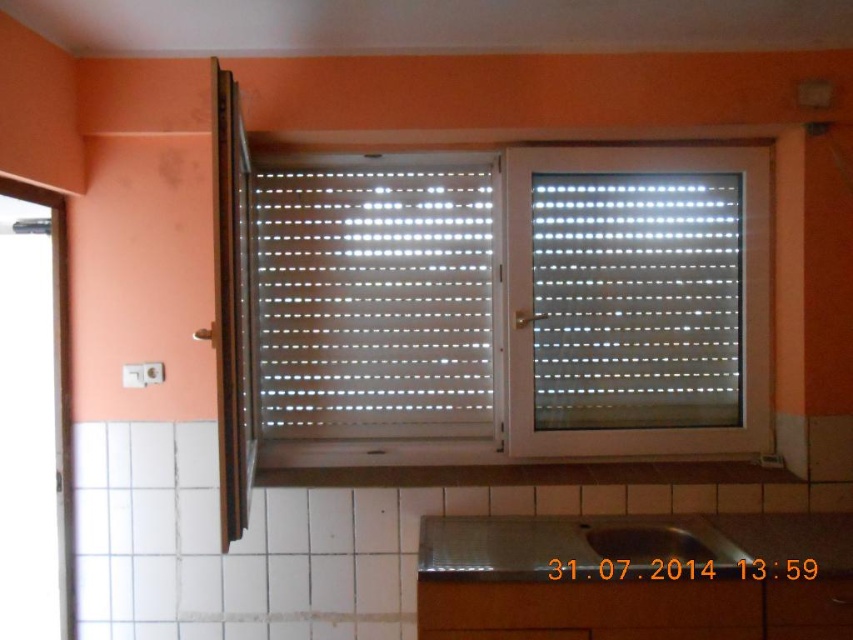
Question: Can you confirm if white plastic blind at center is positioned above white plastic blinds at center?

Choices:
 (A) no
 (B) yes

Answer: (B)

Question: Does white plastic blinds at center have a smaller size compared to stainless steel sink at lower center?

Choices:
 (A) yes
 (B) no

Answer: (A)

Question: Is white plastic blind at center to the left of white plastic blinds at center from the viewer's perspective?

Choices:
 (A) no
 (B) yes

Answer: (B)

Question: Which point is closer to the camera?

Choices:
 (A) white plastic blind at center
 (B) white plastic blinds at center

Answer: (A)

Question: Which object is closer to the camera taking this photo?

Choices:
 (A) white plastic blinds at center
 (B) matte stainless steel sink at lower center
 (C) white plastic blind at center
 (D) stainless steel sink at lower center

Answer: (D)

Question: Which of the following is the farthest from the observer?

Choices:
 (A) (741, 192)
 (B) (373, 378)
 (C) (788, 561)

Answer: (B)